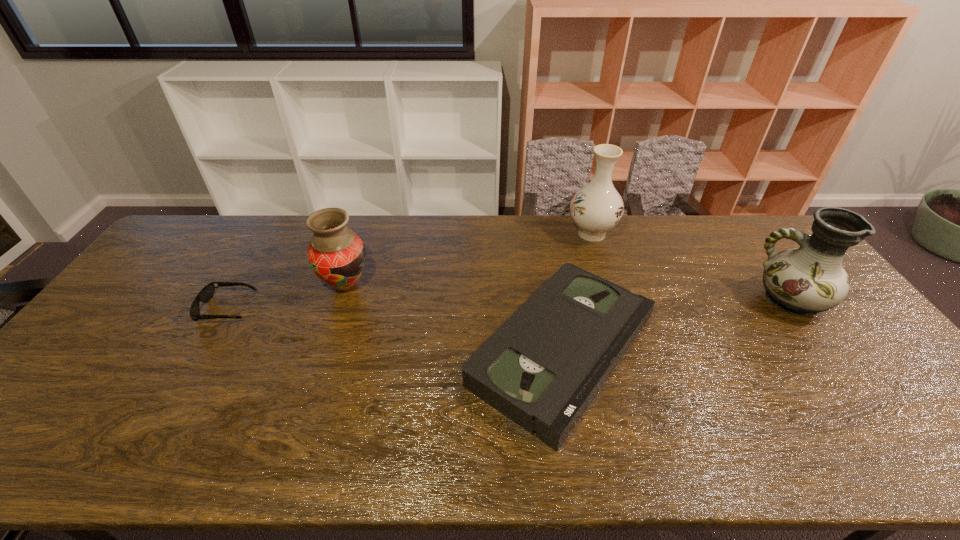
In order to click on free region at the near left corner of the desktop in this screenshot , I will do `click(39, 458)`.

Locate an element on the screen. The image size is (960, 540). empty location between the leftmost vase and the shortest object is located at coordinates (286, 297).

The image size is (960, 540). What are the coordinates of `free spot between the shortest vase and the shortest object` in the screenshot? It's located at (286, 297).

Locate an element on the screen. The width and height of the screenshot is (960, 540). vacant area between the sunglasses and the leftmost vase is located at coordinates point(286,297).

At what (x,y) coordinates should I click in order to perform the action: click on empty space between the farthest vase and the shortest vase. Please return your answer as a coordinate pair (x, y). The width and height of the screenshot is (960, 540). Looking at the image, I should click on (468, 259).

You are a GUI agent. You are given a task and a screenshot of the screen. Output one action in this format:
    pyautogui.click(x=<x>, y=<y>)
    Task: Click on the unoccupied position between the farthest object and the rightmost vase
    The height and width of the screenshot is (540, 960).
    Given the screenshot: What is the action you would take?
    pyautogui.click(x=691, y=267)

At what (x,y) coordinates should I click in order to perform the action: click on free space between the shortest object and the videotape. Please return your answer as a coordinate pair (x, y). Looking at the image, I should click on (395, 329).

Find the location of `free space between the shortest object and the fourth tallest object`. free space between the shortest object and the fourth tallest object is located at coordinates (395, 329).

Locate an element on the screen. object that is the second closest to the rightmost object is located at coordinates (596, 208).

Locate an element on the screen. object that stands as the third closest to the videotape is located at coordinates (808, 280).